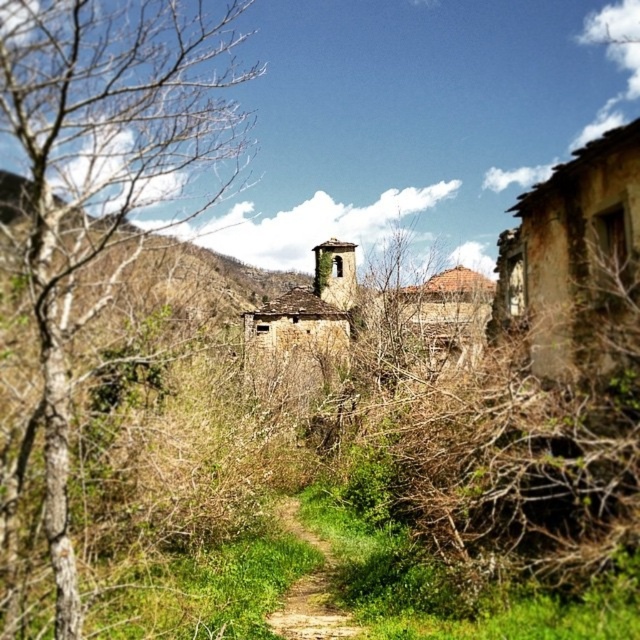
Question: Does bare wood tree at left have a smaller size compared to brown dirt path at center?

Choices:
 (A) no
 (B) yes

Answer: (A)

Question: Is bare wood tree at left thinner than brown dirt path at center?

Choices:
 (A) no
 (B) yes

Answer: (A)

Question: Can you confirm if bare wood tree at left is positioned to the left of brown dirt path at center?

Choices:
 (A) yes
 (B) no

Answer: (A)

Question: Which point is farther from the camera taking this photo?

Choices:
 (A) (129, 257)
 (B) (321, 616)

Answer: (A)

Question: Which point is closer to the camera taking this photo?

Choices:
 (A) (298, 582)
 (B) (64, 380)

Answer: (B)